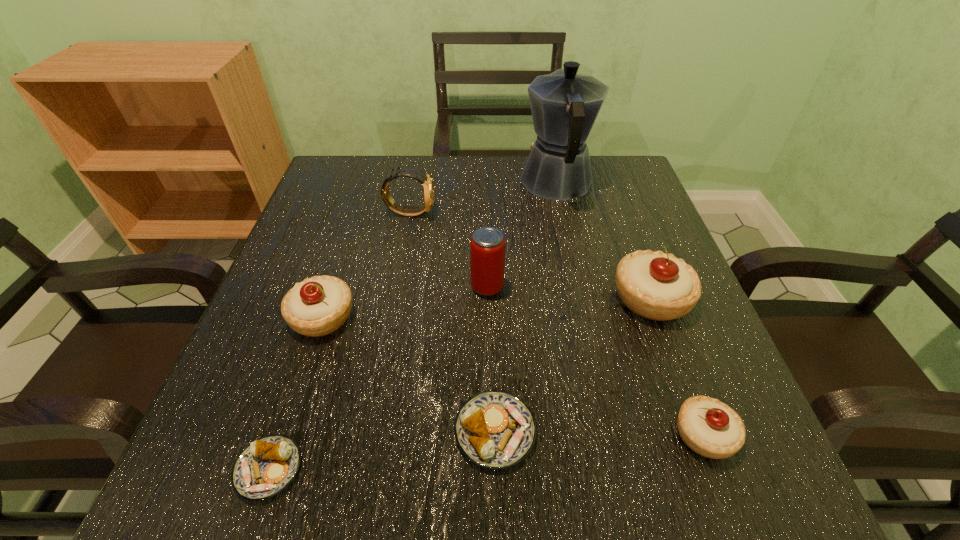
You are a GUI agent. You are given a task and a screenshot of the screen. Output one action in this format:
    pyautogui.click(x=<x>, y=<y>)
    Task: Click on the vacant region at the far right corner of the desktop
    
    Given the screenshot: What is the action you would take?
    pyautogui.click(x=628, y=173)

The image size is (960, 540). I want to click on empty space between the gold watch and the biggest beige pastry, so click(530, 255).

The image size is (960, 540). I want to click on free spot between the sixth object from right to left and the smaller brown pastry, so click(340, 341).

At what (x,y) coordinates should I click in order to perform the action: click on free space between the fourth tallest pastry and the coffeepot. Please return your answer as a coordinate pair (x, y). This screenshot has height=540, width=960. Looking at the image, I should click on (526, 307).

Identify the location of free spot between the watch and the biggest beige pastry. This screenshot has height=540, width=960. (530, 255).

Identify the location of vacant area that lies between the gold watch and the tallest pastry. [x=530, y=255].

Where is `free space between the left brown pastry and the tallest object`? The height and width of the screenshot is (540, 960). free space between the left brown pastry and the tallest object is located at coordinates (413, 326).

At what (x,y) coordinates should I click in order to perform the action: click on free space that is in between the third tallest pastry and the seventh tallest object. Please return your answer as a coordinate pair (x, y). Looking at the image, I should click on (600, 433).

Locate an element on the screen. This screenshot has width=960, height=540. free space between the shortest pastry and the watch is located at coordinates (340, 341).

The width and height of the screenshot is (960, 540). Find the location of `blank region between the third pastry from right to left and the tallest pastry`. blank region between the third pastry from right to left and the tallest pastry is located at coordinates click(573, 365).